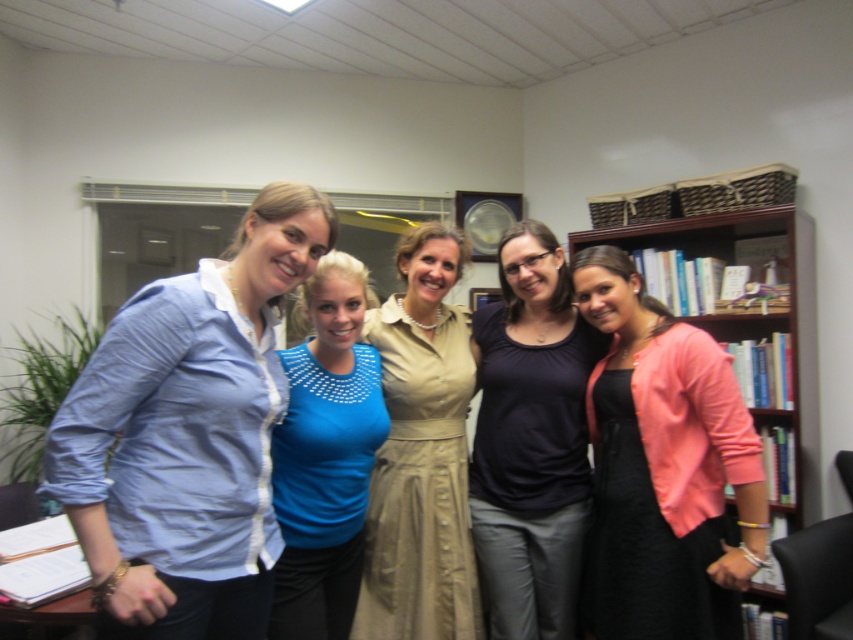
Question: Does matte beige dress at center lie behind wooden bookshelf at right?

Choices:
 (A) yes
 (B) no

Answer: (B)

Question: Can you confirm if light blue shirt at left is positioned to the right of matte black blouse at center?

Choices:
 (A) no
 (B) yes

Answer: (A)

Question: Among these objects, which one is nearest to the camera?

Choices:
 (A) blue jersey at center
 (B) light blue shirt at left
 (C) wooden bookshelf at right

Answer: (B)

Question: Is wooden bookshelf at right behind blue jersey at center?

Choices:
 (A) yes
 (B) no

Answer: (A)

Question: Estimate the real-world distances between objects in this image. Which object is farther from the wooden bookshelf at right?

Choices:
 (A) blue jersey at center
 (B) matte beige dress at center
 (C) light blue shirt at left

Answer: (C)

Question: Which point is farther to the camera?

Choices:
 (A) matte beige dress at center
 (B) light blue shirt at left

Answer: (A)